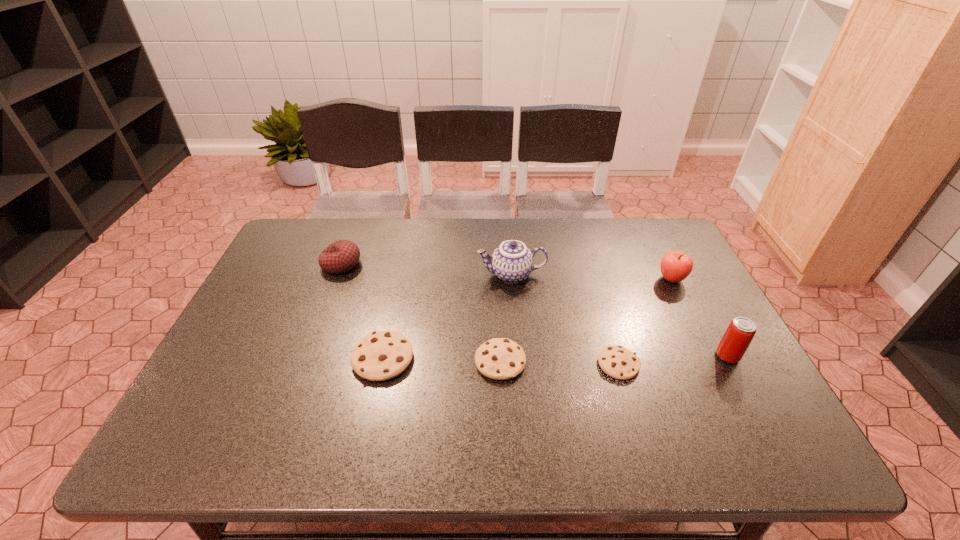
What are the coordinates of `the fifth tallest object` in the screenshot? It's located at (379, 356).

At what (x,y) coordinates should I click in order to perform the action: click on the leftmost cookie. Please return your answer as a coordinate pair (x, y). This screenshot has height=540, width=960. Looking at the image, I should click on (379, 356).

You are a GUI agent. You are given a task and a screenshot of the screen. Output one action in this format:
    pyautogui.click(x=<x>, y=<y>)
    Task: Click on the second shortest object
    
    Given the screenshot: What is the action you would take?
    pyautogui.click(x=499, y=358)

Locate an element on the screen. This screenshot has width=960, height=540. the second shortest cookie is located at coordinates (499, 358).

Locate an element on the screen. The width and height of the screenshot is (960, 540). the rightmost cookie is located at coordinates (618, 362).

I want to click on the shortest cookie, so click(x=618, y=362).

Where is `chinaware`? The image size is (960, 540). chinaware is located at coordinates (512, 262).

Where is `the fourth tallest object`? The image size is (960, 540). the fourth tallest object is located at coordinates (341, 256).

You are a GUI agent. You are given a task and a screenshot of the screen. Output one action in this format:
    pyautogui.click(x=<x>, y=<y>)
    Task: Click on the leftmost object
    This screenshot has width=960, height=540.
    Given the screenshot: What is the action you would take?
    pyautogui.click(x=341, y=256)

This screenshot has height=540, width=960. Find the location of `apple`. apple is located at coordinates (675, 266).